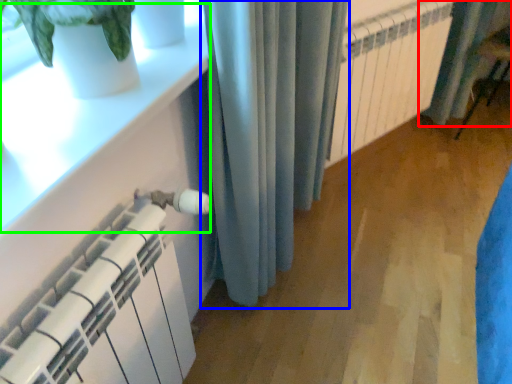
Question: Which object is the closest to the curtain (highlighted by a red box)? Choose among these: curtain (highlighted by a blue box) or window sill (highlighted by a green box).

Choices:
 (A) curtain
 (B) window sill

Answer: (A)